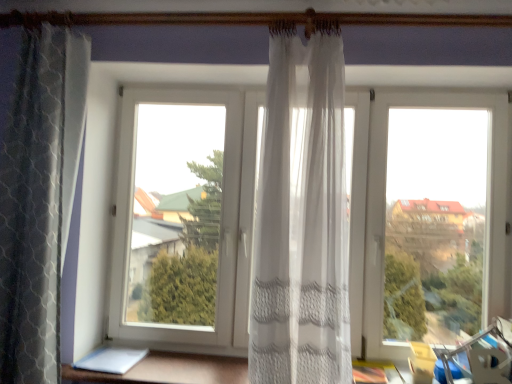
Question: Can you confirm if white sheer curtain at lower center is positioned to the left of sheer white curtain at center, marked as the first curtain in a right-to-left arrangement?

Choices:
 (A) no
 (B) yes

Answer: (B)

Question: Does white sheer curtain at lower center have a greater width compared to sheer white curtain at center, marked as the first curtain in a right-to-left arrangement?

Choices:
 (A) no
 (B) yes

Answer: (B)

Question: Can we say white sheer curtain at lower center lies outside sheer white curtain at center, which ranks as the 2th curtain in left-to-right order?

Choices:
 (A) yes
 (B) no

Answer: (A)

Question: Can you confirm if white sheer curtain at lower center is shorter than sheer white curtain at center, which ranks as the 2th curtain in left-to-right order?

Choices:
 (A) no
 (B) yes

Answer: (B)

Question: Does white sheer curtain at lower center turn towards sheer white curtain at center, which ranks as the 2th curtain in left-to-right order?

Choices:
 (A) no
 (B) yes

Answer: (A)

Question: Considering the relative positions of white sheer curtain at lower center and sheer white curtain at center, marked as the first curtain in a right-to-left arrangement, in the image provided, is white sheer curtain at lower center to the right of sheer white curtain at center, marked as the first curtain in a right-to-left arrangement, from the viewer's perspective?

Choices:
 (A) no
 (B) yes

Answer: (A)

Question: Does textured gray curtain at left, arranged as the 1th curtain when viewed from the left, have a greater width compared to sheer white curtain at center, which ranks as the 2th curtain in left-to-right order?

Choices:
 (A) yes
 (B) no

Answer: (B)

Question: Is textured gray curtain at left, arranged as the 1th curtain when viewed from the left, positioned in front of sheer white curtain at center, marked as the first curtain in a right-to-left arrangement?

Choices:
 (A) no
 (B) yes

Answer: (A)

Question: Is textured gray curtain at left, arranged as the second curtain when viewed from the right, placed right next to sheer white curtain at center, which ranks as the 2th curtain in left-to-right order?

Choices:
 (A) no
 (B) yes

Answer: (A)

Question: From a real-world perspective, does textured gray curtain at left, arranged as the second curtain when viewed from the right, stand above sheer white curtain at center, marked as the first curtain in a right-to-left arrangement?

Choices:
 (A) no
 (B) yes

Answer: (A)

Question: From the image's perspective, is textured gray curtain at left, arranged as the 1th curtain when viewed from the left, below sheer white curtain at center, marked as the first curtain in a right-to-left arrangement?

Choices:
 (A) yes
 (B) no

Answer: (B)

Question: Considering the relative sizes of textured gray curtain at left, arranged as the 1th curtain when viewed from the left, and sheer white curtain at center, which ranks as the 2th curtain in left-to-right order, in the image provided, is textured gray curtain at left, arranged as the 1th curtain when viewed from the left, shorter than sheer white curtain at center, which ranks as the 2th curtain in left-to-right order,?

Choices:
 (A) no
 (B) yes

Answer: (A)

Question: Does sheer white curtain at center, marked as the first curtain in a right-to-left arrangement, have a greater height compared to textured gray curtain at left, arranged as the 1th curtain when viewed from the left?

Choices:
 (A) yes
 (B) no

Answer: (B)